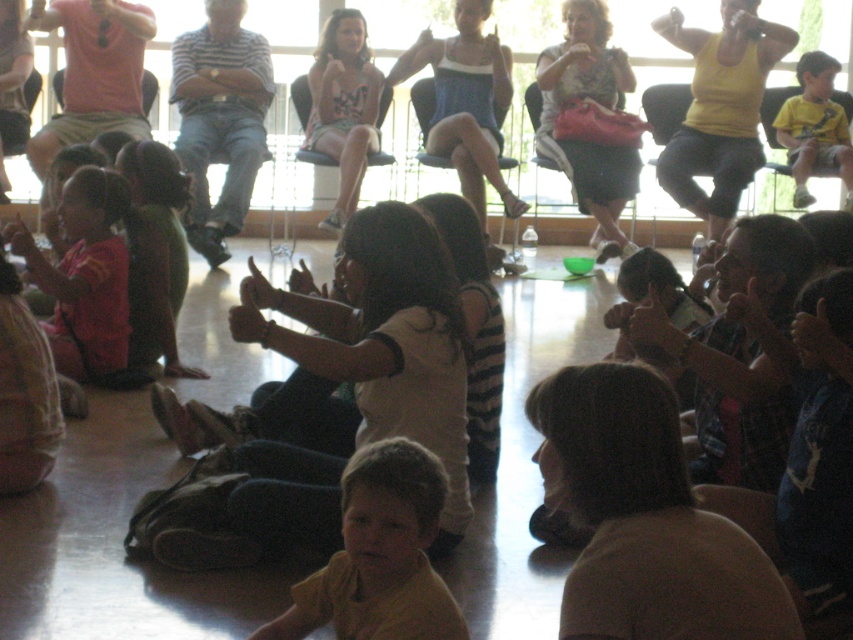
You are a photographer standing at the entrance of the room. You need to capture a photo that includes both the matte black dress at upper center and the floral dress at center. The camera you are using has a maximum focus range of 1.5 meters. Will you be able to focus on both subjects simultaneously?

The matte black dress at upper center is 1.53 meters away from the floral dress at center. Since the distance between them exceeds the camera maximum focus range of 1.5 meters, the camera cannot focus on both subjects simultaneously.

You are a photographer standing at the front of the room where the children are seated. You want to take a photo of the adults in the background. Which of the two adults, the one wearing the matte black dress at upper center or the one in the floral dress at center, is closer to you?

The matte black dress at upper center is closer to you because the floral dress at center is positioned behind it.

Based on the photo, you are a photographer setting up for a group photo. You need to ensure that the smooth beige shirt at lower right and the yellow matte shirt at lower center are both visible in the frame. Considering their sizes, which one might require more space in the composition?

The smooth beige shirt at lower right is bigger than the yellow matte shirt at lower center, so it would require more space in the composition to ensure it is fully visible.